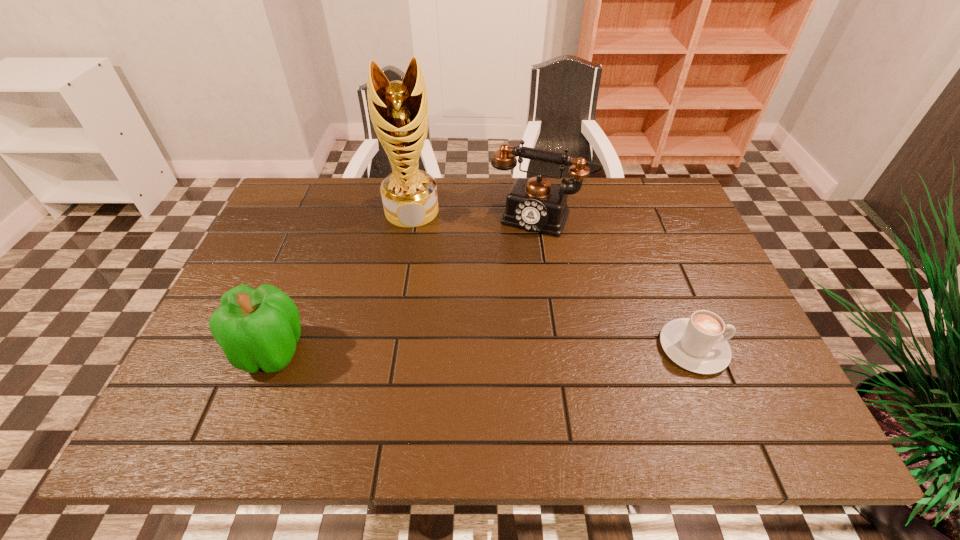
The height and width of the screenshot is (540, 960). Find the location of `vacant space at the near right corner`. vacant space at the near right corner is located at coordinates 750,389.

This screenshot has width=960, height=540. Identify the location of unoccupied position between the second object from right to left and the tallest object. (476, 214).

The height and width of the screenshot is (540, 960). Identify the location of vacant region between the shortest object and the tallest object. (553, 279).

Locate an element on the screen. free spot between the tallest object and the cappuccino is located at coordinates (553, 279).

You are a GUI agent. You are given a task and a screenshot of the screen. Output one action in this format:
    pyautogui.click(x=<x>, y=<y>)
    Task: Click on the vacant area between the third object from left to right and the rightmost object
    The image size is (960, 540).
    Given the screenshot: What is the action you would take?
    pyautogui.click(x=617, y=283)

Find the location of a particular element. This screenshot has height=540, width=960. vacant space that's between the tallest object and the second tallest object is located at coordinates (476, 214).

Locate an element on the screen. The height and width of the screenshot is (540, 960). vacant area that lies between the award and the third tallest object is located at coordinates tap(343, 281).

Locate an element on the screen. The height and width of the screenshot is (540, 960). free space between the third object from right to left and the bell pepper is located at coordinates (343, 281).

In order to click on vacant point located between the bell pepper and the rightmost object in this screenshot , I will do `click(483, 349)`.

Image resolution: width=960 pixels, height=540 pixels. What are the coordinates of `vacant space that's between the shortest object and the telephone` in the screenshot? It's located at (617, 283).